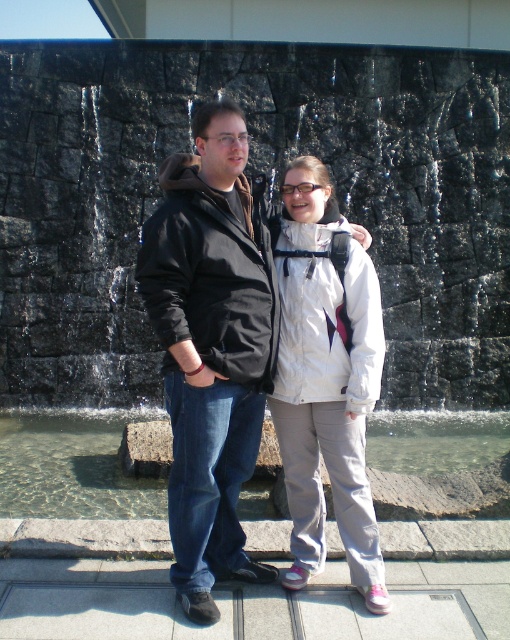
Can you confirm if matte black jacket at center is smaller than white matte jacket at center?

Actually, matte black jacket at center might be larger than white matte jacket at center.

Is matte black jacket at center above white matte jacket at center?

Yes.

Which is in front, point (165, 236) or point (299, 227)?

Point (165, 236) is in front.

Find the location of `matte black jacket at center`. matte black jacket at center is located at coordinates (211, 348).

Is matte black jacket at center to the right of clear glass water at lower center from the viewer's perspective?

Indeed, matte black jacket at center is positioned on the right side of clear glass water at lower center.

Can you confirm if matte black jacket at center is positioned below clear glass water at lower center?

Incorrect, matte black jacket at center is not positioned below clear glass water at lower center.

Image resolution: width=510 pixels, height=640 pixels. What do you see at coordinates (211, 348) in the screenshot?
I see `matte black jacket at center` at bounding box center [211, 348].

This screenshot has height=640, width=510. I want to click on matte black jacket at center, so click(x=211, y=348).

Is white matte jacket at center closer to the viewer compared to clear glass water at lower center?

Yes, it is in front of clear glass water at lower center.

Between point (321, 509) and point (119, 516), which one is positioned behind?

The point (119, 516) is behind.

Locate an element on the screen. The height and width of the screenshot is (640, 510). white matte jacket at center is located at coordinates (326, 380).